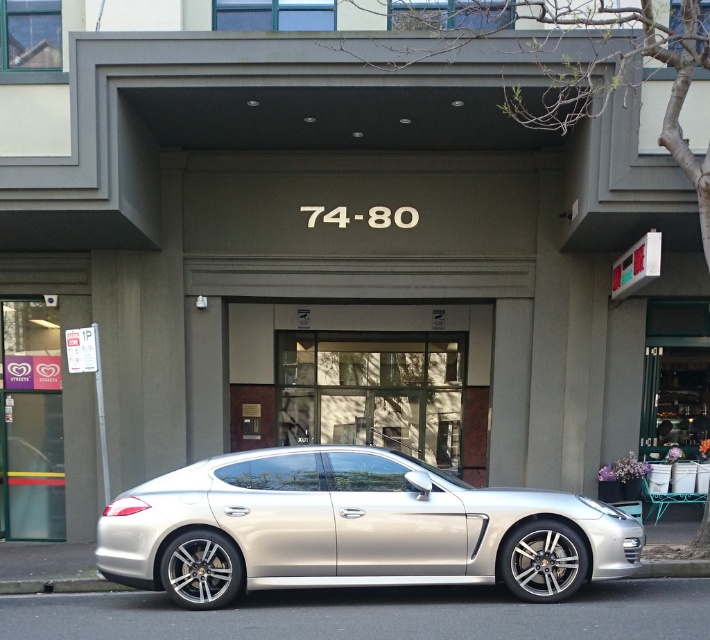
Question: Which object is closer to the camera taking this photo?

Choices:
 (A) silver metallic car at center
 (B) clear glass door at center

Answer: (A)

Question: Which point is farther to the camera?

Choices:
 (A) (376, 579)
 (B) (288, 412)

Answer: (B)

Question: Can you confirm if silver metallic car at center is positioned to the left of clear glass door at center?

Choices:
 (A) yes
 (B) no

Answer: (B)

Question: Is silver metallic car at center positioned at the back of clear glass door at center?

Choices:
 (A) yes
 (B) no

Answer: (B)

Question: Is silver metallic car at center positioned before clear glass door at center?

Choices:
 (A) yes
 (B) no

Answer: (A)